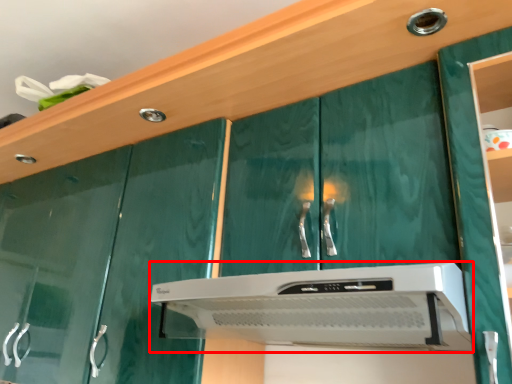
Question: From the image, what is the correct spatial relationship of home appliance (annotated by the red box) in relation to knob?

Choices:
 (A) left
 (B) right

Answer: (A)